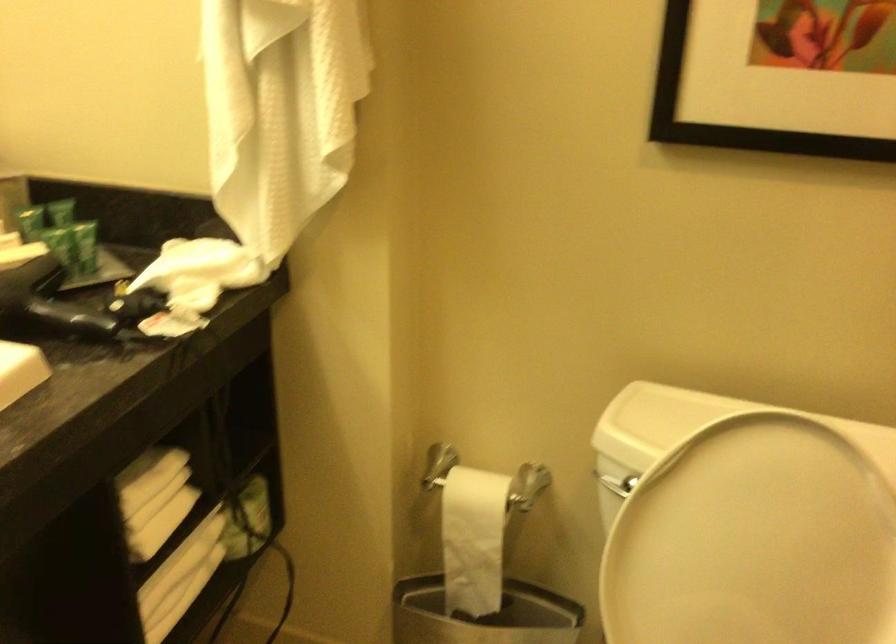
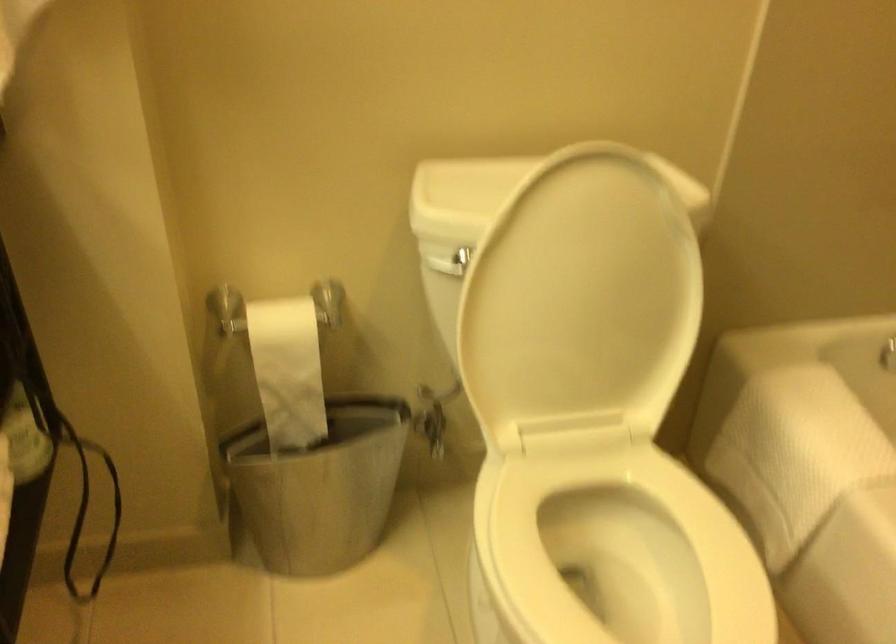
Where in the second image is the point corresponding to point 752,567 from the first image?

(581, 301)